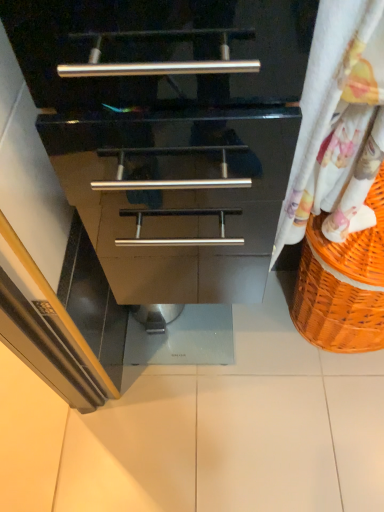
Question: Is white floral fabric at right surrounded by orange woven basket at right?

Choices:
 (A) yes
 (B) no

Answer: (B)

Question: Is orange woven basket at right behind white floral fabric at right?

Choices:
 (A) yes
 (B) no

Answer: (A)

Question: Is orange woven basket at right taller than white floral fabric at right?

Choices:
 (A) yes
 (B) no

Answer: (B)

Question: From the image's perspective, does orange woven basket at right appear lower than white floral fabric at right?

Choices:
 (A) no
 (B) yes

Answer: (B)

Question: Can you confirm if orange woven basket at right is bigger than white floral fabric at right?

Choices:
 (A) no
 (B) yes

Answer: (B)

Question: Is orange woven basket at right shorter than white floral fabric at right?

Choices:
 (A) no
 (B) yes

Answer: (B)

Question: Is white floral fabric at right not close to white glossy tile at center?

Choices:
 (A) no
 (B) yes

Answer: (A)

Question: Considering the relative sizes of white floral fabric at right and white glossy tile at center in the image provided, is white floral fabric at right bigger than white glossy tile at center?

Choices:
 (A) yes
 (B) no

Answer: (A)

Question: Is white floral fabric at right smaller than white glossy tile at center?

Choices:
 (A) yes
 (B) no

Answer: (B)

Question: Is white floral fabric at right at the right side of white glossy tile at center?

Choices:
 (A) yes
 (B) no

Answer: (A)

Question: Does white floral fabric at right have a greater height compared to white glossy tile at center?

Choices:
 (A) no
 (B) yes

Answer: (B)

Question: Is white floral fabric at right closer to camera compared to white glossy tile at center?

Choices:
 (A) no
 (B) yes

Answer: (B)

Question: Is white glossy tile at center to the left of white floral fabric at right from the viewer's perspective?

Choices:
 (A) yes
 (B) no

Answer: (A)